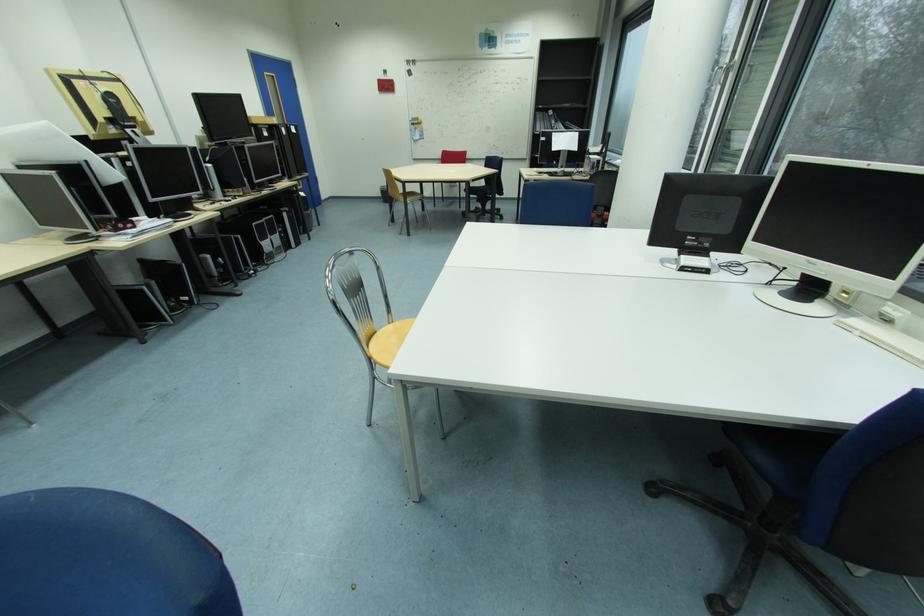
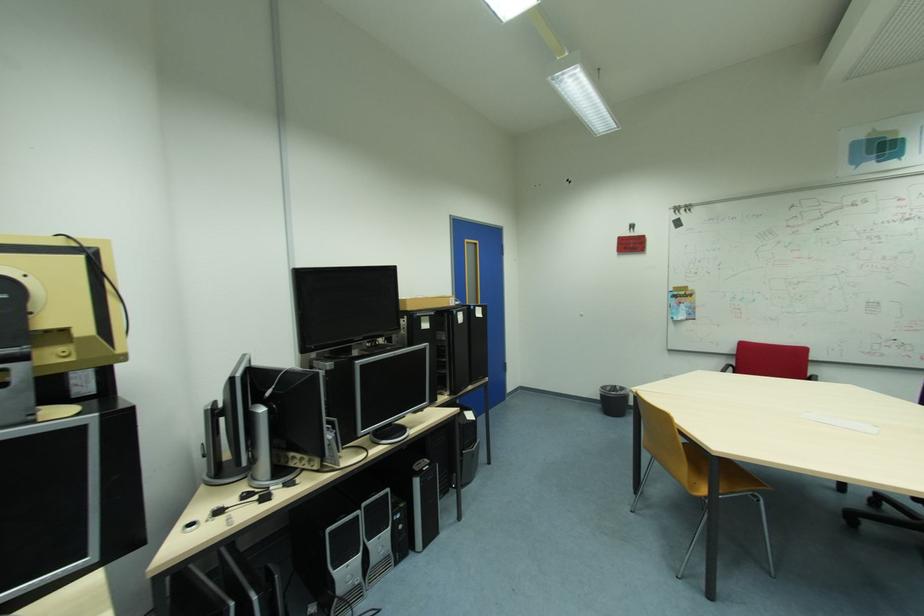
Find the pixel in the second image that matches point (387, 196) in the first image.

(605, 400)